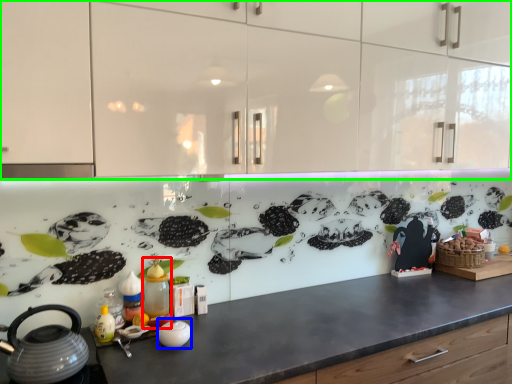
Question: Which is farther away from bottle (highlighted by a red box)? appliance (highlighted by a blue box) or cabinetry (highlighted by a green box)?

Choices:
 (A) appliance
 (B) cabinetry

Answer: (B)